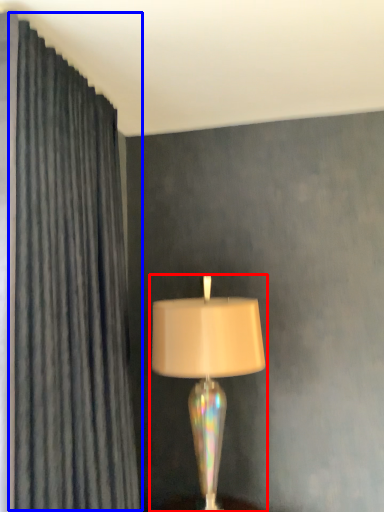
Question: Which of the following is the closest to the observer, lamp (highlighted by a red box) or curtain (highlighted by a blue box)?

Choices:
 (A) lamp
 (B) curtain

Answer: (B)